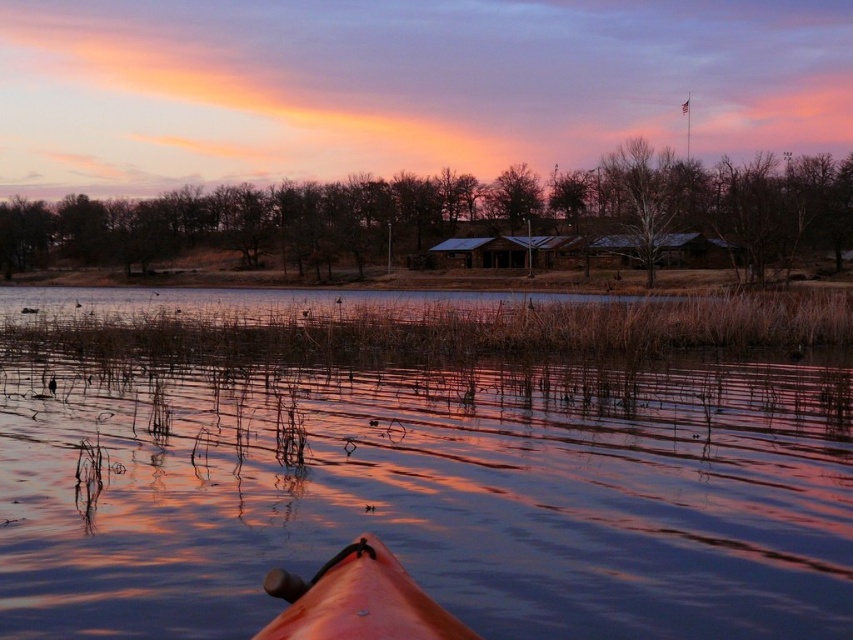
Which is more to the right, smooth water at center or orange matte kayak at lower center?

From the viewer's perspective, orange matte kayak at lower center appears more on the right side.

Measure the distance from smooth water at center to orange matte kayak at lower center.

smooth water at center and orange matte kayak at lower center are 9.94 meters apart from each other.

Between point (813, 484) and point (363, 609), which one is positioned in front?

Positioned in front is point (363, 609).

Identify the location of smooth water at center. This screenshot has width=853, height=640. (433, 493).